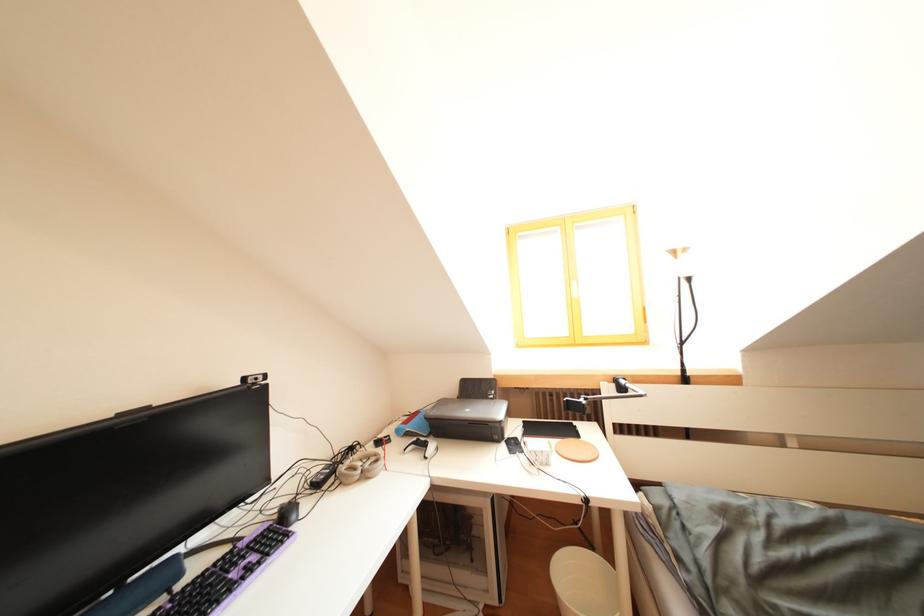
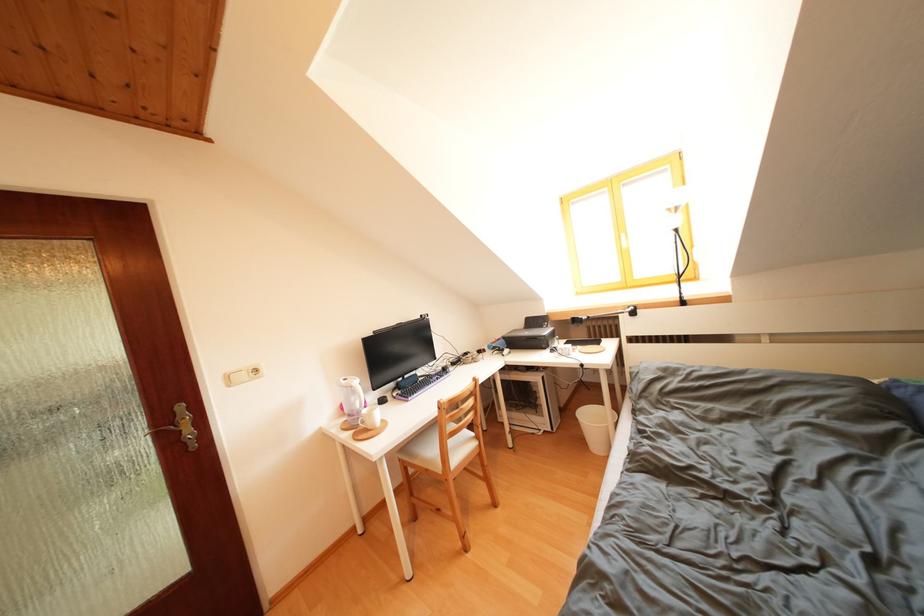
What movement of the cameraman would produce the second image?

The cameraman walked toward right, backward.